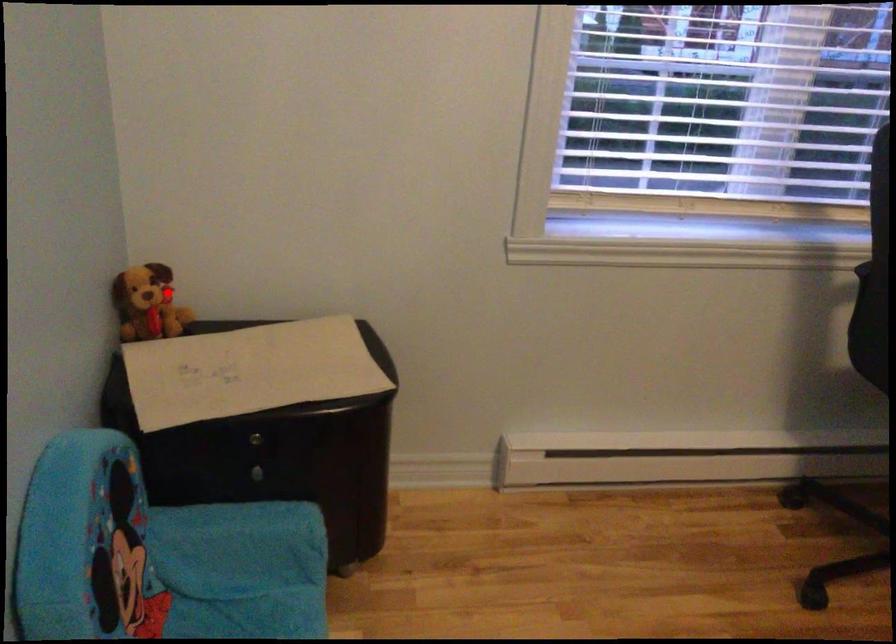
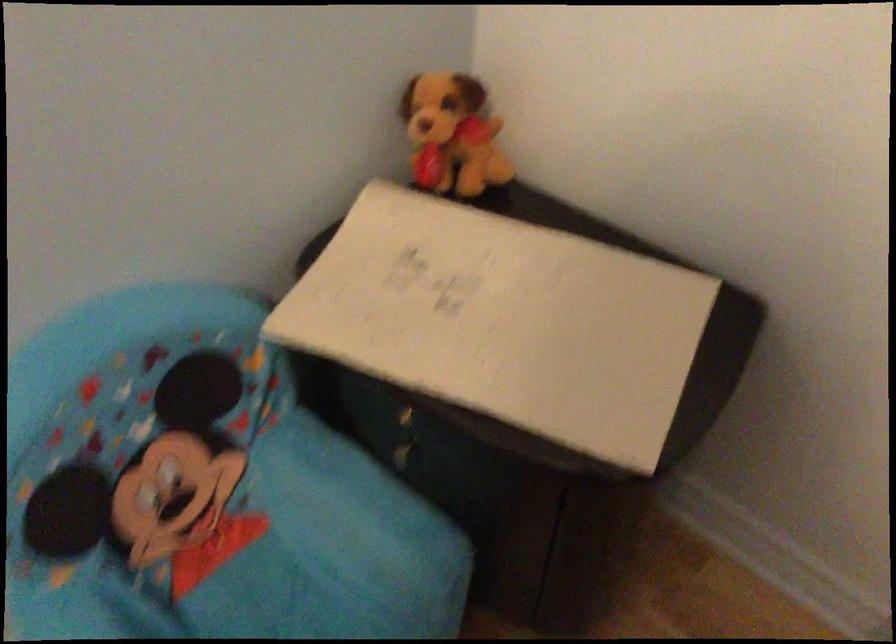
Question: I am providing you with two images of the same scene from different viewpoints. Given a red point in image1, look at the same physical point in image2. Is it:

Choices:
 (A) Closer to the viewpoint
 (B) Farther from the viewpoint

Answer: (A)